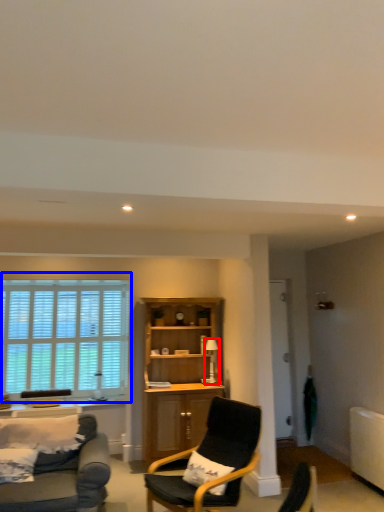
Question: Which object is closer to the camera taking this photo, lamp (highlighted by a red box) or window (highlighted by a blue box)?

Choices:
 (A) lamp
 (B) window

Answer: (A)